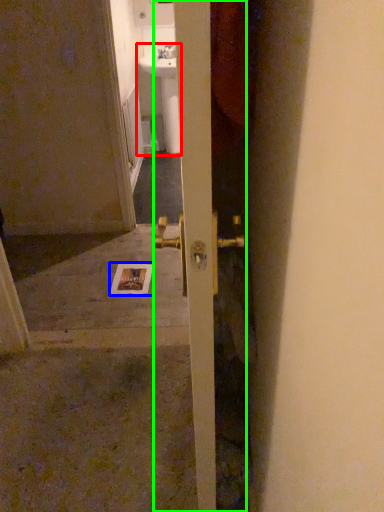
Question: Which object is the farthest from sink (highlighted by a red box)? Choose among these: postcard (highlighted by a blue box) or door (highlighted by a green box).

Choices:
 (A) postcard
 (B) door

Answer: (B)